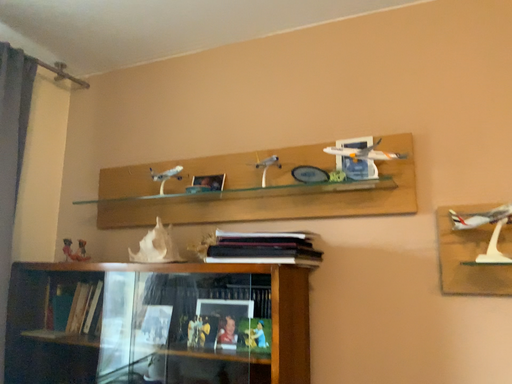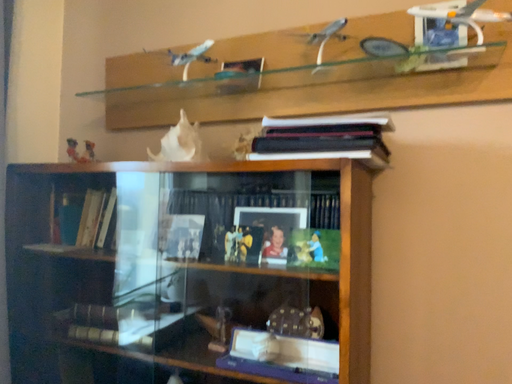
Question: How did the camera likely rotate when shooting the video?

Choices:
 (A) rotated upward
 (B) rotated downward

Answer: (B)